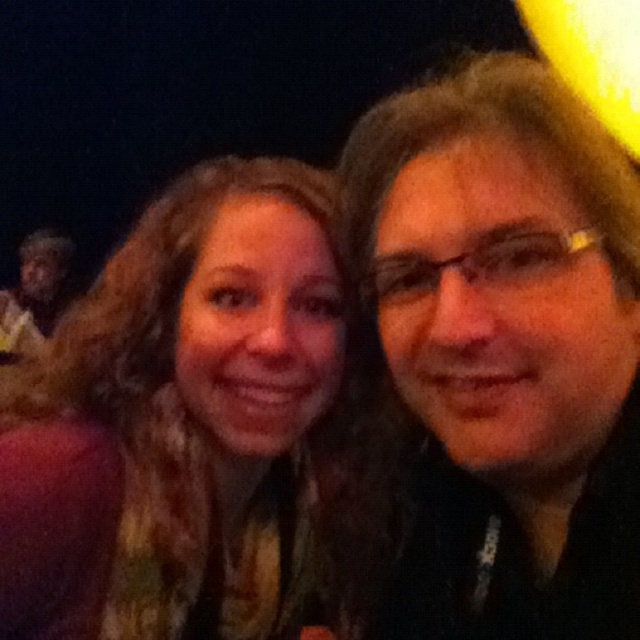
Can you confirm if matte black hair at center is bigger than dark skin face at left?

No.

Is matte black hair at center further to camera compared to dark skin face at left?

No, matte black hair at center is closer to the viewer.

Does point (536, 227) come in front of point (38, 240)?

Yes, point (536, 227) is closer to viewer.

Identify the location of matte black hair at center. The width and height of the screenshot is (640, 640). (506, 349).

Is matte black hair at center below multicolored scarf at center?

No, matte black hair at center is not below multicolored scarf at center.

Does matte black hair at center have a lesser width compared to multicolored scarf at center?

Yes, matte black hair at center is thinner than multicolored scarf at center.

Between point (529, 330) and point (236, 476), which one is positioned in front?

Point (529, 330) is in front.

This screenshot has width=640, height=640. What are the coordinates of `matte black hair at center` in the screenshot? It's located at (506, 349).

Which of these two, multicolored scarf at center or dark skin face at left, stands taller?

dark skin face at left

What do you see at coordinates (180, 420) in the screenshot? I see `multicolored scarf at center` at bounding box center [180, 420].

You are a GUI agent. You are given a task and a screenshot of the screen. Output one action in this format:
    pyautogui.click(x=<x>, y=<y>)
    Task: Click on the multicolored scarf at center
    Image resolution: width=640 pixels, height=640 pixels.
    Given the screenshot: What is the action you would take?
    pyautogui.click(x=180, y=420)